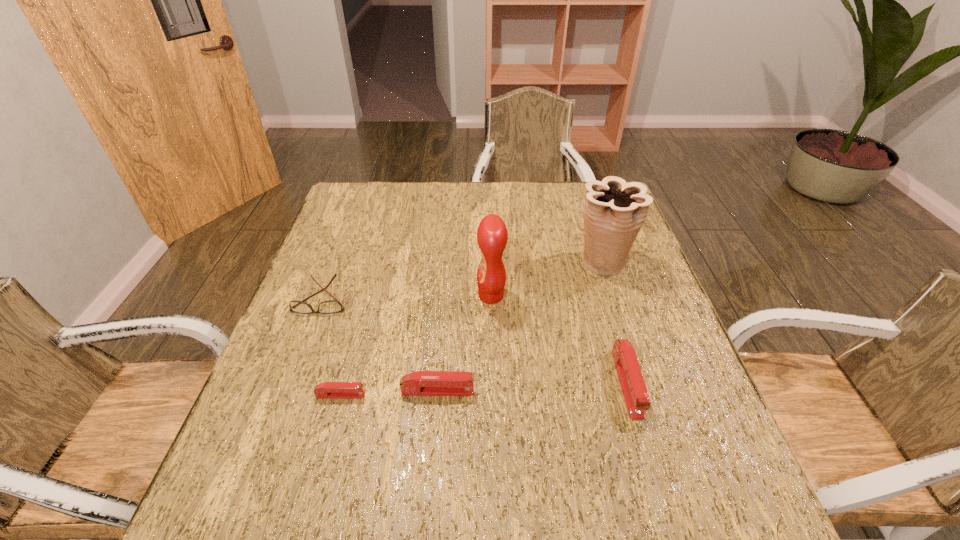
Where is `vacant point that satisfies the following two spatial constraints: 1. on the front-facing side of the rightmost stapler; 2. on the front-facing side of the second stapler from right to left`? The image size is (960, 540). vacant point that satisfies the following two spatial constraints: 1. on the front-facing side of the rightmost stapler; 2. on the front-facing side of the second stapler from right to left is located at coordinates (629, 391).